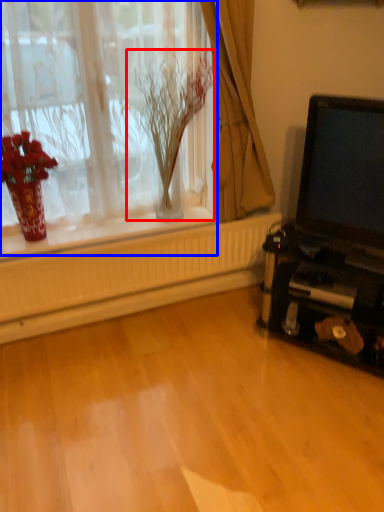
Question: Which object is further to the camera taking this photo, plant (highlighted by a red box) or window (highlighted by a blue box)?

Choices:
 (A) plant
 (B) window

Answer: (A)